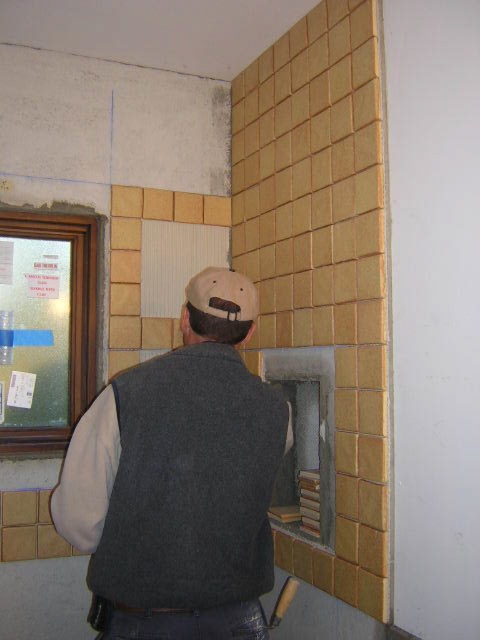
Between dark gray wool vest at center and wooden handle hammer at lower center, which one is positioned higher?

dark gray wool vest at center is above.

In order to click on dark gray wool vest at center in this screenshot , I will do (x=177, y=490).

Is point (148, 433) more distant than point (291, 580)?

No, it is not.

Where is `dark gray wool vest at center`? This screenshot has height=640, width=480. dark gray wool vest at center is located at coordinates (177, 490).

Can you confirm if dark gray wool vest at center is positioned to the left of fuzzy beige baseball hat at upper center?

Correct, you'll find dark gray wool vest at center to the left of fuzzy beige baseball hat at upper center.

Identify the location of dark gray wool vest at center. The image size is (480, 640). (177, 490).

Is point (277, 148) farther from viewer compared to point (291, 593)?

Yes, it is.

Does yellow tile at center appear on the left side of wooden handle hammer at lower center?

Incorrect, yellow tile at center is not on the left side of wooden handle hammer at lower center.

What do you see at coordinates (323, 260) in the screenshot? I see `yellow tile at center` at bounding box center [323, 260].

Identify the location of yellow tile at center. The width and height of the screenshot is (480, 640). (323, 260).